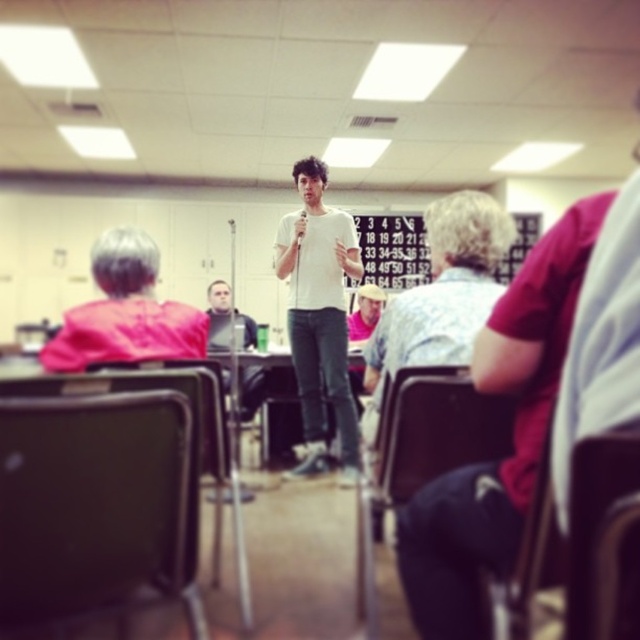
You are a person carrying a large box that is 36 inches wide. You need to walk through the space between the black plastic chair at lower right and the brown leather chair at lower right. Can you fit through the gap between them?

The black plastic chair at lower right and brown leather chair at lower right are 33.06 inches apart from each other. Since the box is 36 inches wide, it is wider than the gap, so you cannot fit through the space between them.

You are a person who is 1.7 meters tall and want to sit on the black plastic chair at lower right and brown leather chair at lower right. Which chair would require you to climb higher to sit?

The black plastic chair at lower right is much taller than the brown leather chair at lower right, so you would need to climb higher to sit on the black plastic chair at lower right.